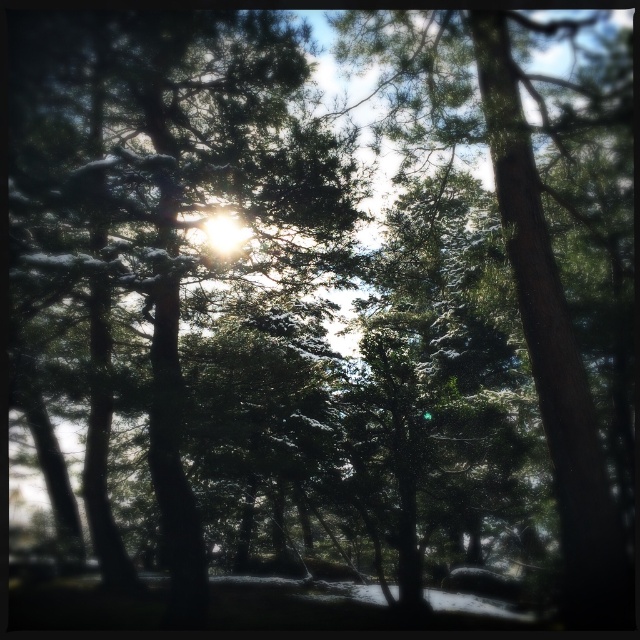
You are a photographer standing in the forest scene. You notice two points of light breaking through the trees. One is at point (138,97) and the other at point (474,33). Which point is closer to your camera?

Point (138,97) is further to the camera than point (474,33), so the point closer to the camera is point (474,33).

You are a hiker who wants to measure the distance between the two trees in the forest. You have a measuring tape that can extend up to 25 feet. Can you measure the distance between the green matte tree at center and the green textured tree at center with your current equipment?

The green matte tree at center and green textured tree at center are 26.88 feet apart from each other, which is beyond the 25 feet capacity of your measuring tape. You would need a longer measuring tape or another method to accurately measure the distance between them.

You are a hiker who wants to take a photo of the green matte tree at center and the green textured tree at center. Which tree should you focus on first if you want to capture both in a single frame without moving the camera?

You should focus on the green textured tree at center first because it is shorter than the green matte tree at center, allowing you to include both in the frame by adjusting the camera angle to capture the taller tree without moving the camera.